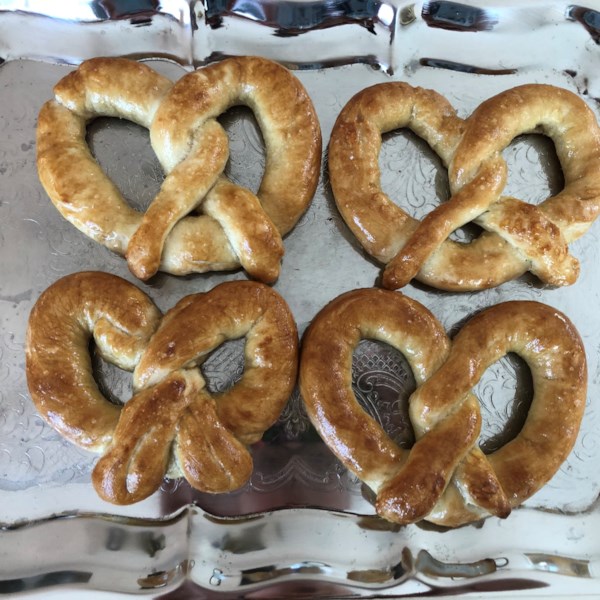
The width and height of the screenshot is (600, 600). Identify the location of burn marks on tray. (24, 146), (19, 300).